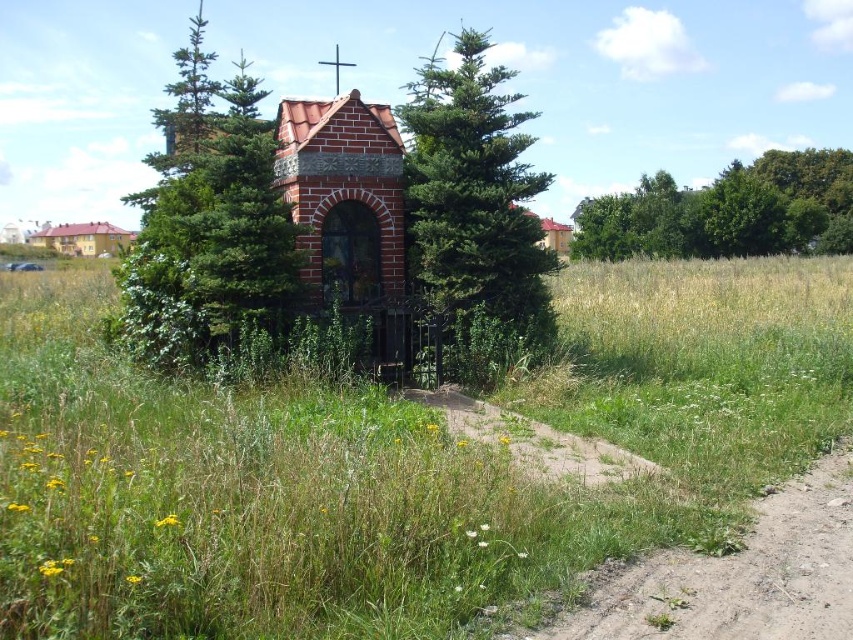
Question: Among these points, which one is farthest from the camera?

Choices:
 (A) (189, 360)
 (B) (114, 244)
 (C) (486, 244)

Answer: (B)

Question: Is green grassy at center smaller than green leafy trees at upper right?

Choices:
 (A) yes
 (B) no

Answer: (A)

Question: Which object is positioned closest to the brown sandy dirt track at lower right?

Choices:
 (A) red brick chapel at center
 (B) green leafy tree at center
 (C) green leafy trees at upper right

Answer: (A)

Question: Where is red brick chapel at center located in relation to brown brick church at upper left in the image?

Choices:
 (A) above
 (B) below

Answer: (B)

Question: Which point is closer to the camera?

Choices:
 (A) green grassy at center
 (B) green coniferous tree at center

Answer: (A)

Question: Does green coniferous tree at center have a lesser width compared to green leafy trees at upper right?

Choices:
 (A) yes
 (B) no

Answer: (A)